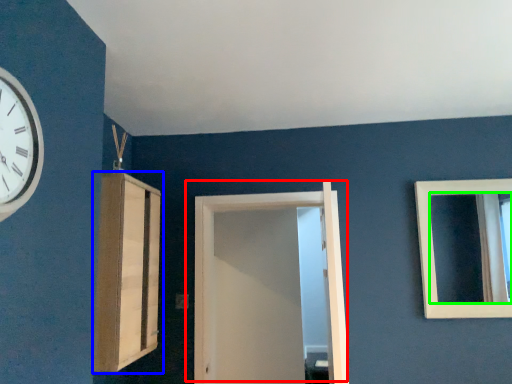
Question: Estimate the real-world distances between objects in this image. Which object is farther from door (highlighted by a red box), cabinetry (highlighted by a blue box) or mirror (highlighted by a green box)?

Choices:
 (A) cabinetry
 (B) mirror

Answer: (B)